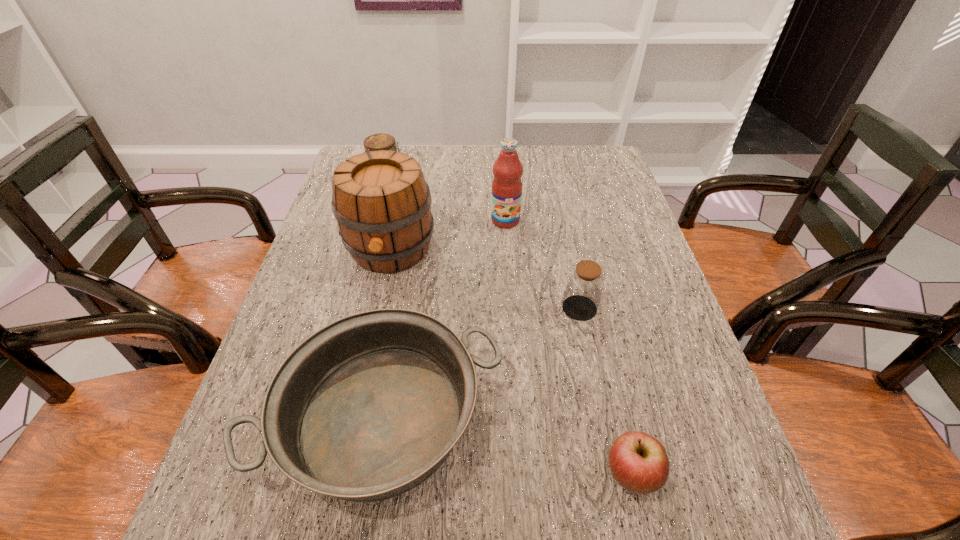
This screenshot has height=540, width=960. Find the location of `empty space that is in between the fruit juice and the farther jar`. empty space that is in between the fruit juice and the farther jar is located at coordinates (446, 200).

Where is `empty space that is in between the pan and the apple`? This screenshot has height=540, width=960. empty space that is in between the pan and the apple is located at coordinates (506, 448).

Identify the location of unoccupied position between the fruit juice and the apple. point(567,348).

Find the location of a particular element. blank region between the apple and the cider is located at coordinates pyautogui.click(x=511, y=363).

Where is `free spot between the cider and the fruit juice`? free spot between the cider and the fruit juice is located at coordinates (448, 235).

Where is `object that is the third nearest to the apple`? This screenshot has width=960, height=540. object that is the third nearest to the apple is located at coordinates (382, 204).

I want to click on object that stands as the second closest to the left jar, so click(506, 196).

This screenshot has height=540, width=960. What are the coordinates of `free region that satisfies the following two spatial constraints: 1. on the front label of the apple; 2. on the left side of the fruit juice` in the screenshot? It's located at (522, 476).

You are a GUI agent. You are given a task and a screenshot of the screen. Output one action in this format:
    pyautogui.click(x=<x>, y=<y>)
    Task: Click on the free spot that satisfies the following two spatial constraints: 1. on the lid of the apple; 2. on the left side of the left jar
    
    Given the screenshot: What is the action you would take?
    pyautogui.click(x=308, y=476)

The width and height of the screenshot is (960, 540). In order to click on free space that satisfies the following two spatial constraints: 1. on the lid of the farthest object; 2. on the back side of the apple in this screenshot , I will do `click(308, 476)`.